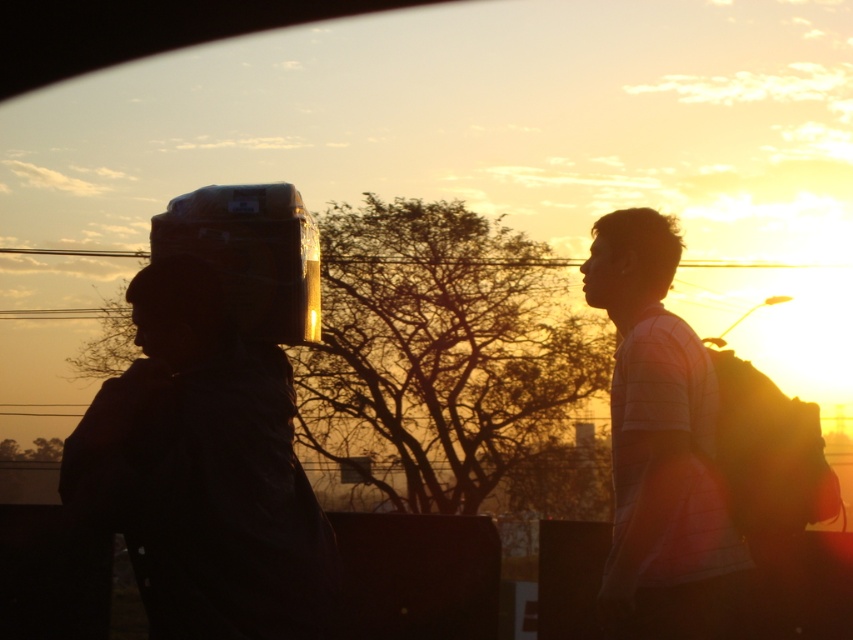
Question: Among these objects, which one is nearest to the camera?

Choices:
 (A) matte black helmet at left
 (B) white striped shirt at right

Answer: (A)

Question: Where is matte black helmet at left located in relation to white striped shirt at right in the image?

Choices:
 (A) left
 (B) right

Answer: (A)

Question: Which point is closer to the camera?

Choices:
 (A) (619, 614)
 (B) (222, 348)

Answer: (B)

Question: Is matte black helmet at left closer to camera compared to white striped shirt at right?

Choices:
 (A) no
 (B) yes

Answer: (B)

Question: Is matte black helmet at left to the right of white striped shirt at right from the viewer's perspective?

Choices:
 (A) no
 (B) yes

Answer: (A)

Question: Which object appears closest to the camera in this image?

Choices:
 (A) white striped shirt at right
 (B) matte black helmet at left

Answer: (B)